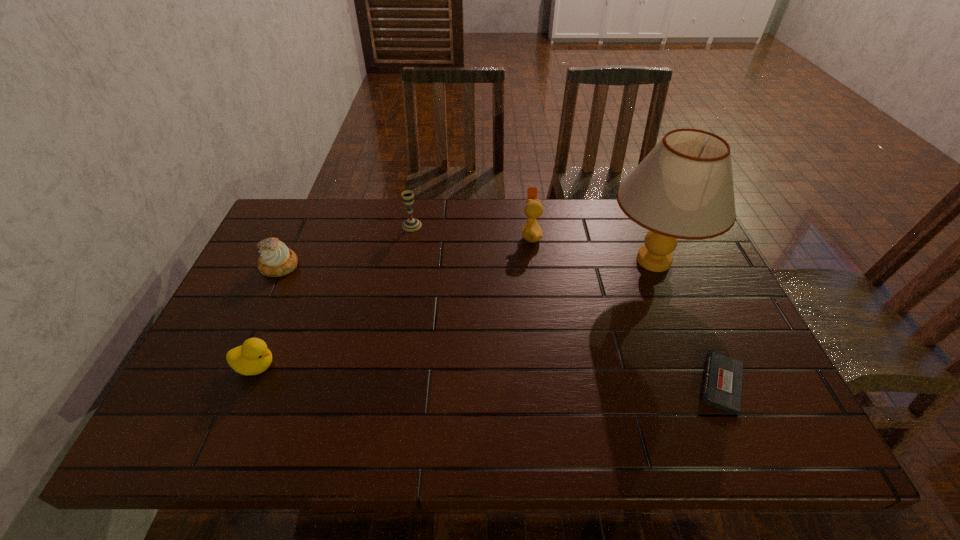
Where is `free space located on the beak of the farther duck`? This screenshot has height=540, width=960. free space located on the beak of the farther duck is located at coordinates (460, 235).

Where is `vacant point located on the beak of the farther duck`? This screenshot has width=960, height=540. vacant point located on the beak of the farther duck is located at coordinates (482, 235).

Where is `vacant space located 0.380m on the left of the chalice`? vacant space located 0.380m on the left of the chalice is located at coordinates (282, 225).

This screenshot has height=540, width=960. I want to click on vacant space positioned on the front of the pastry, so click(x=255, y=317).

Find the location of a particular element. vacant region located 0.360m on the front-facing side of the left duck is located at coordinates (432, 366).

You are a GUI agent. You are given a task and a screenshot of the screen. Output one action in this format:
    pyautogui.click(x=<x>, y=<y>)
    Task: Click on the vacant space located 0.310m on the left of the shortest object
    The height and width of the screenshot is (540, 960).
    Given the screenshot: What is the action you would take?
    pyautogui.click(x=556, y=383)

Where is `lampshade that is positioned at the far edge`? Image resolution: width=960 pixels, height=540 pixels. lampshade that is positioned at the far edge is located at coordinates (683, 189).

Find the location of a particular element. The width and height of the screenshot is (960, 540). duck that is positioned at the far edge is located at coordinates (531, 232).

This screenshot has height=540, width=960. Identify the location of chalice present at the far edge. (411, 224).

Where is `object located at the near edge`? Image resolution: width=960 pixels, height=540 pixels. object located at the near edge is located at coordinates (722, 384).